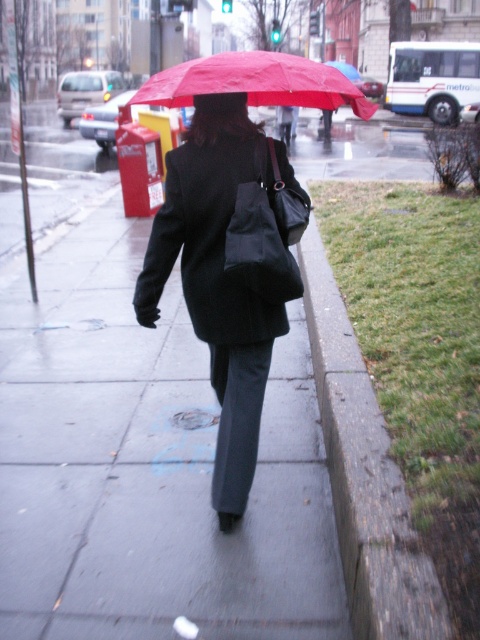
You are a delivery person trying to avoid stepping on the grass. You see the gray concrete sidewalk at center and the matte black coat at center. Which one should you step on to stay on the path?

You should step on the gray concrete sidewalk at center because it is bigger than the matte black coat at center and is the designated path for pedestrians.

You are a delivery person trying to avoid getting your package wet during the rain. You see the gray concrete sidewalk at center and the matte black coat at center. Which surface should you place the package on to keep it dry?

The gray concrete sidewalk at center is positioned under matte black coat at center, so placing the package on the matte black coat at center would keep it dry as it is above the sidewalk.

You are standing on the sidewalk and see a point marked at coordinates (159, 248). If you want to place a 3 meter long bench there, will it fit without overlapping the grass or the curb on the right side?

The point at (159, 248) is 2.68 meters away from the viewer. Since the bench is 3 meters long, it would extend beyond the available space, overlapping the grass or curb on the right side.